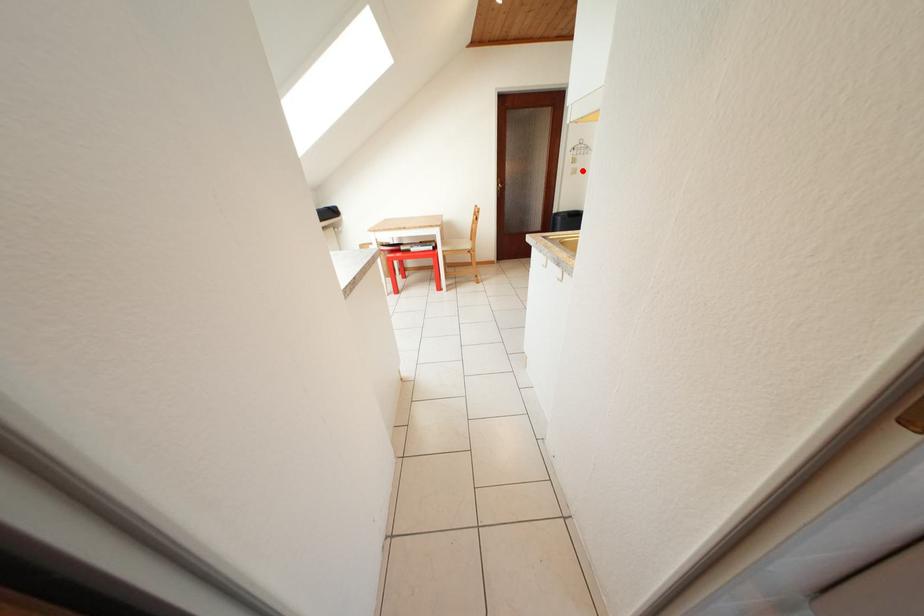
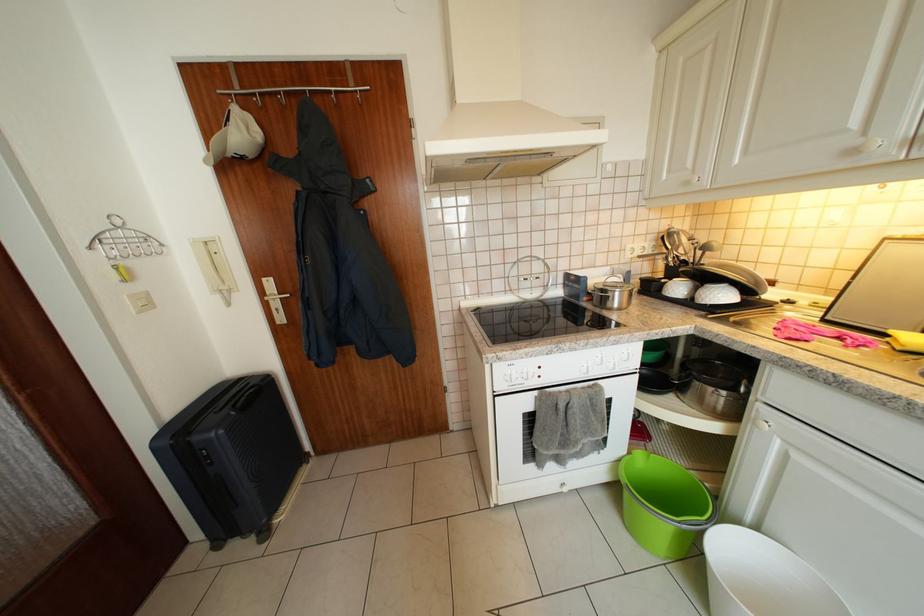
Question: A red point is marked in image1. In image2, is the corresponding 3D point closer to the camera or farther? Reply with the corresponding letter.

Choices:
 (A) The corresponding 3D point is closer.
 (B) The corresponding 3D point is farther.

Answer: (B)